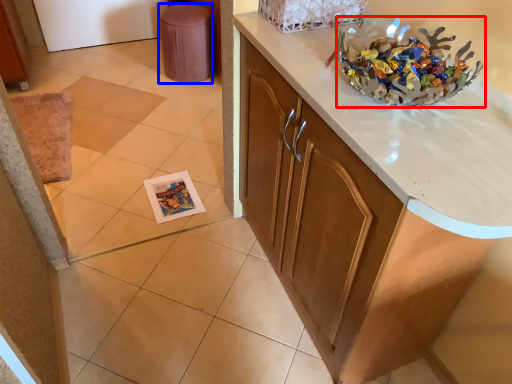
Question: Which of the following is the closest to the observer, stuff (highlighted by a red box) or stool (highlighted by a blue box)?

Choices:
 (A) stuff
 (B) stool

Answer: (A)